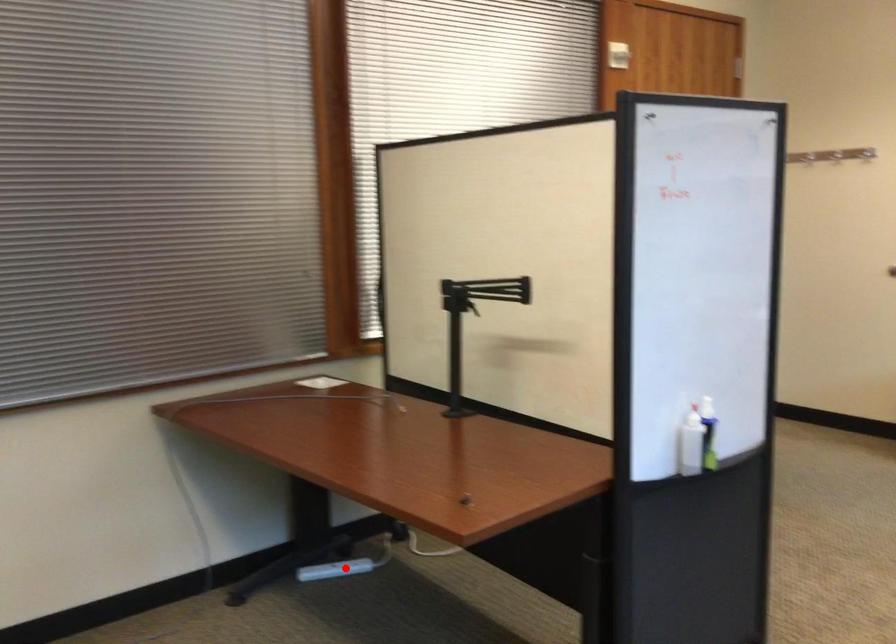
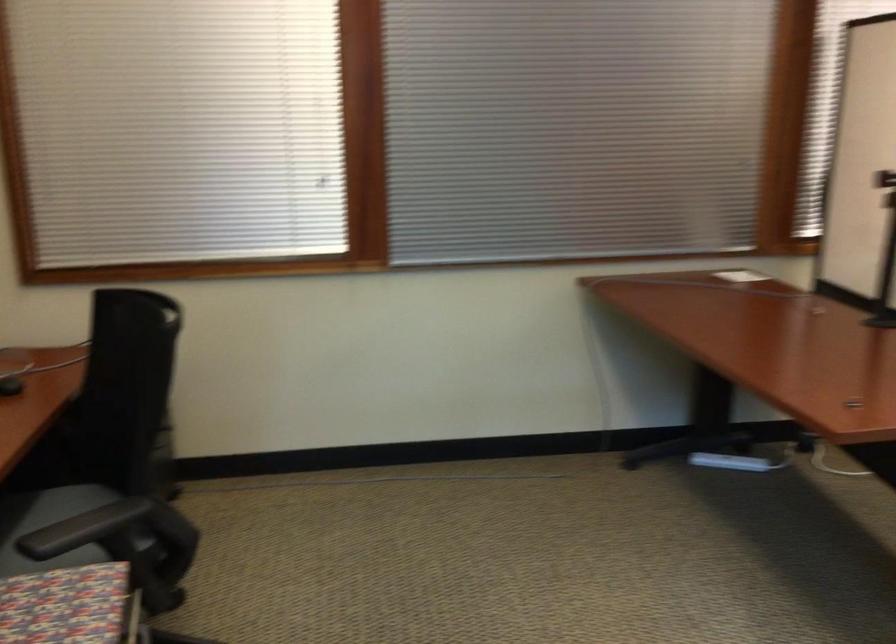
Where in the second image is the point corresponding to the highlighted location from the first image?

(730, 462)